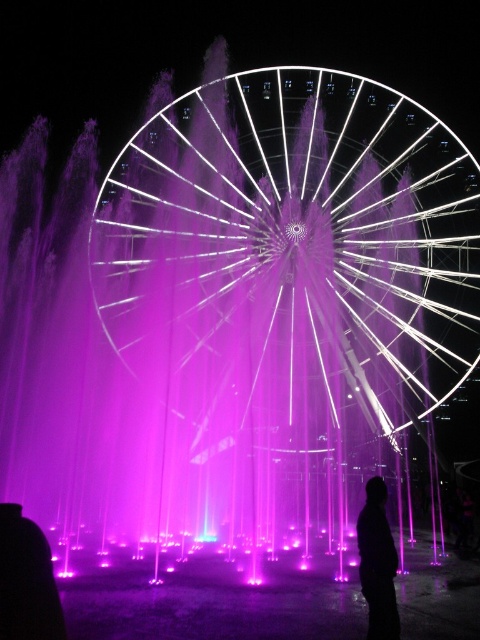
Can you confirm if white metallic ferris wheel at center is positioned above black matte silhouette at lower right?

Indeed, white metallic ferris wheel at center is positioned over black matte silhouette at lower right.

Between white metallic ferris wheel at center and black matte silhouette at lower right, which one is positioned higher?

white metallic ferris wheel at center

Describe the element at coordinates (289, 256) in the screenshot. The width and height of the screenshot is (480, 640). I see `white metallic ferris wheel at center` at that location.

At what (x,y) coordinates should I click in order to perform the action: click on white metallic ferris wheel at center. Please return your answer as a coordinate pair (x, y). Looking at the image, I should click on (289, 256).